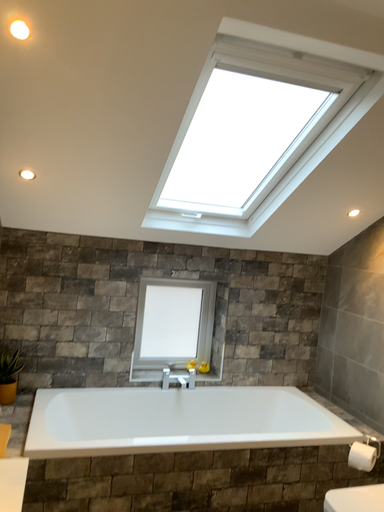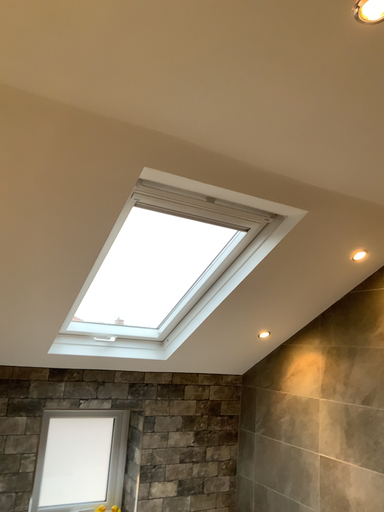
Question: How did the camera likely rotate when shooting the video?

Choices:
 (A) rotated downward
 (B) rotated upward

Answer: (B)